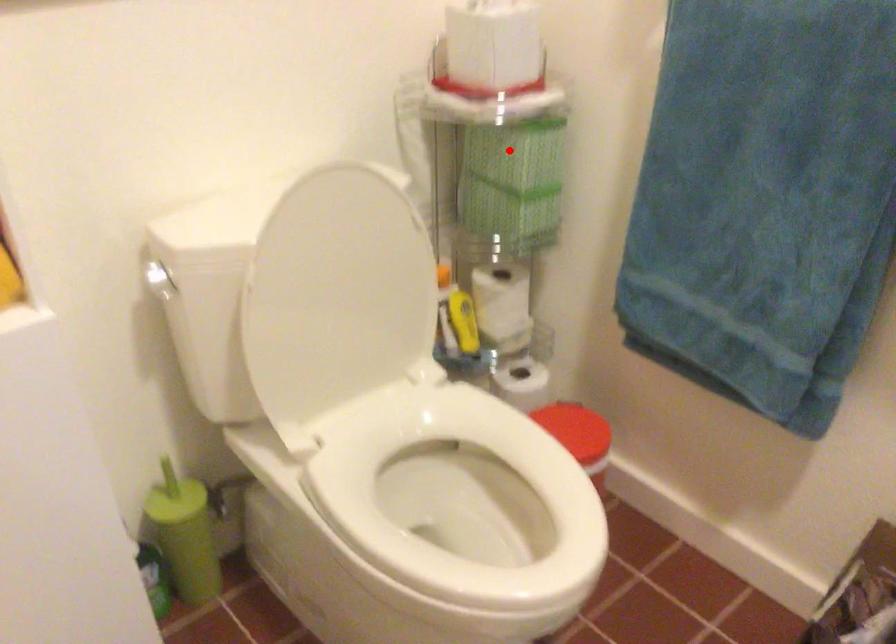
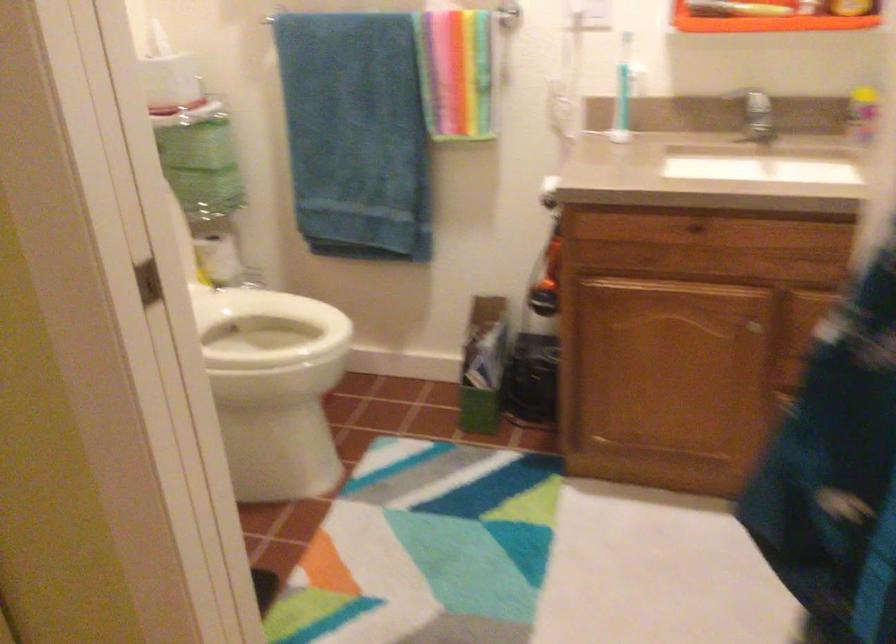
The point at the highlighted location is marked in the first image. Where is the corresponding point in the second image?

(196, 145)